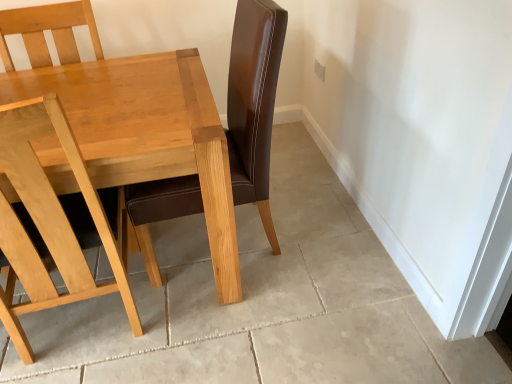
You are a GUI agent. You are given a task and a screenshot of the screen. Output one action in this format:
    pyautogui.click(x=<x>, y=<y>)
    Task: Click on the free location to the right of light wood table at center
    This screenshot has height=384, width=512.
    Given the screenshot: What is the action you would take?
    pyautogui.click(x=311, y=275)